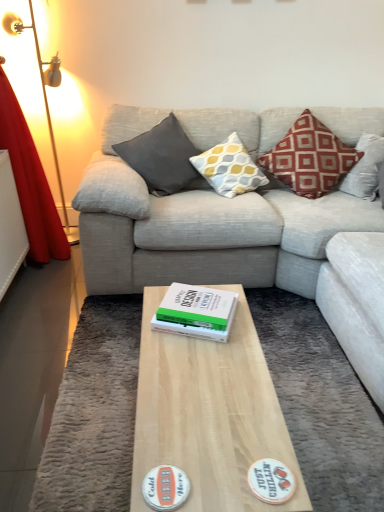
What are the coordinates of `vacant space behind light wood coffee table at center` in the screenshot? It's located at (251, 322).